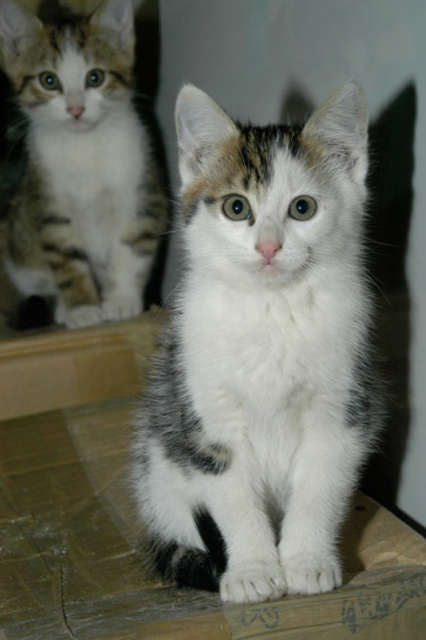
Which is behind, point (235, 132) or point (40, 266)?

The point (40, 266) is more distant.

Measure the distance between point (330, 220) and camera.

Point (330, 220) is 1.25 meters away from camera.

Measure the distance between point (181,188) and camera.

Point (181,188) is 1.66 meters from camera.

The width and height of the screenshot is (426, 640). In order to click on white fluffy cat at center in this screenshot , I will do `click(261, 355)`.